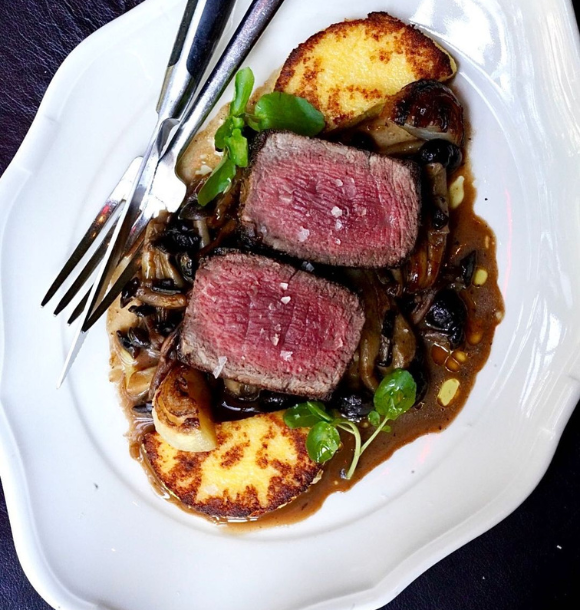
The height and width of the screenshot is (610, 580). Find the location of `white plate`. white plate is located at coordinates (81, 409).